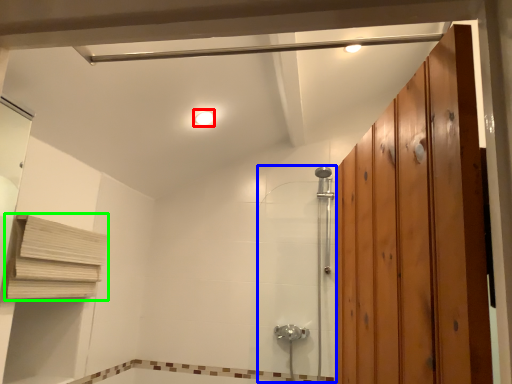
Question: Which is nearer to the light fixture (highlighted by a red box)? shower door (highlighted by a blue box) or shelf (highlighted by a green box).

Choices:
 (A) shower door
 (B) shelf

Answer: (B)